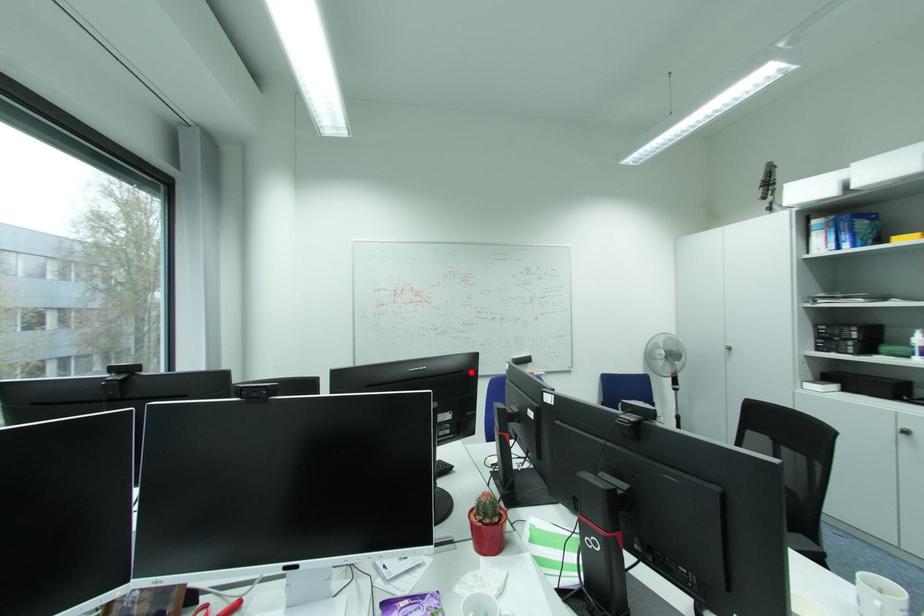
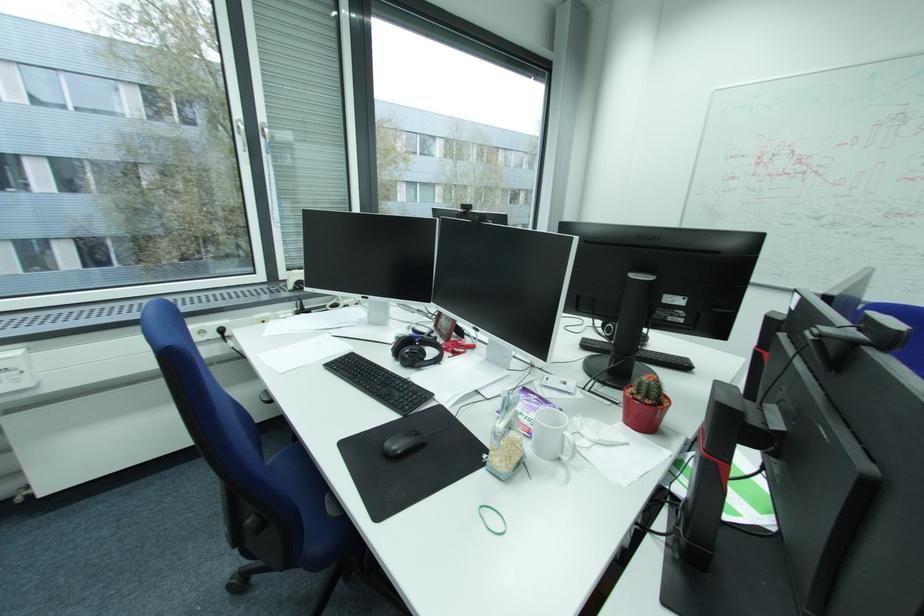
Find the pixel in the second image that matches the highlighted location in the first image.

(725, 253)